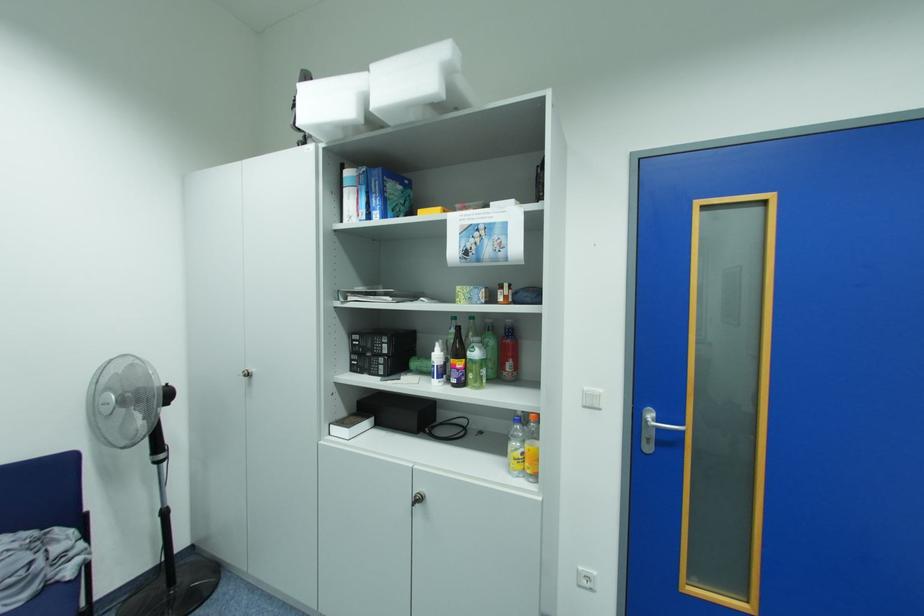
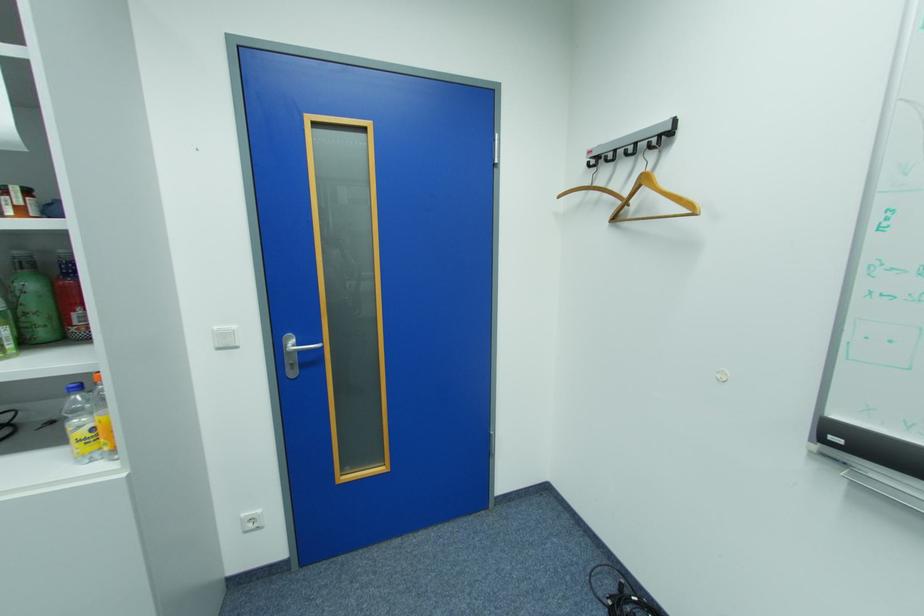
The point at (x=665, y=421) is marked in the first image. Where is the corresponding point in the second image?

(307, 344)